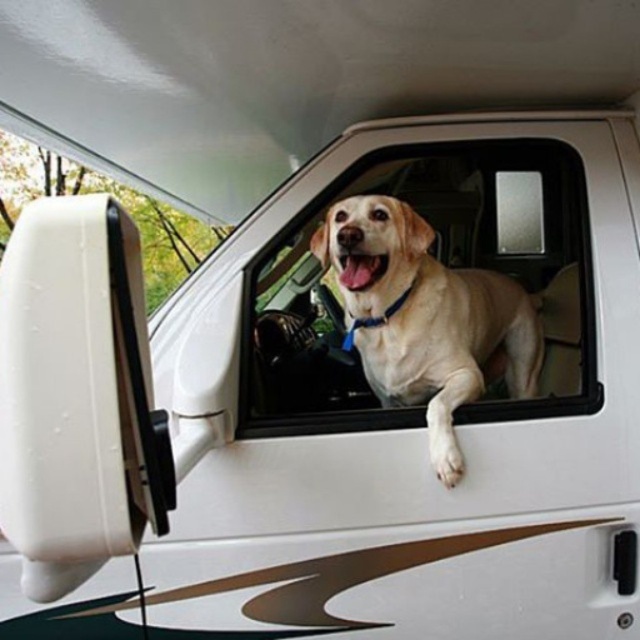
Does point (374, 356) come closer to viewer compared to point (397, 378)?

No, (374, 356) is behind (397, 378).

Which of these two, light beige fabric car window at center or golden fur dog at center, stands taller?

light beige fabric car window at center is taller.

Is point (344, 381) less distant than point (449, 392)?

No, it is behind (449, 392).

The height and width of the screenshot is (640, 640). In order to click on light beige fabric car window at center in this screenshot , I will do `click(428, 292)`.